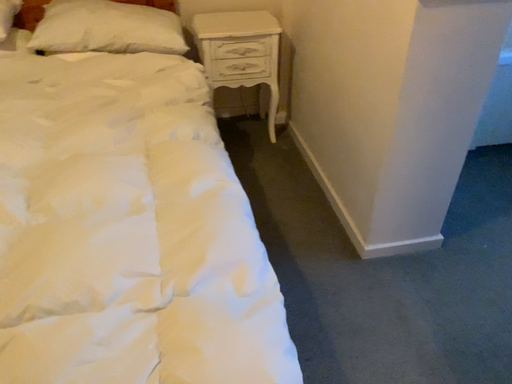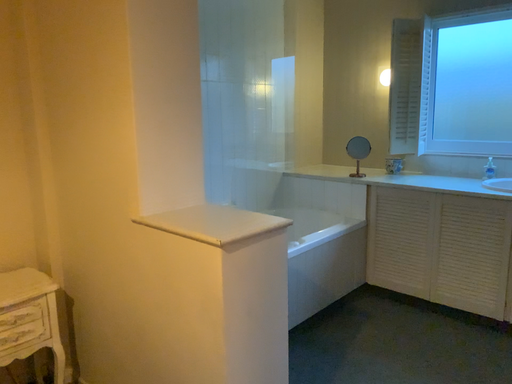
Question: Which way did the camera rotate in the video?

Choices:
 (A) rotated downward
 (B) rotated upward

Answer: (B)